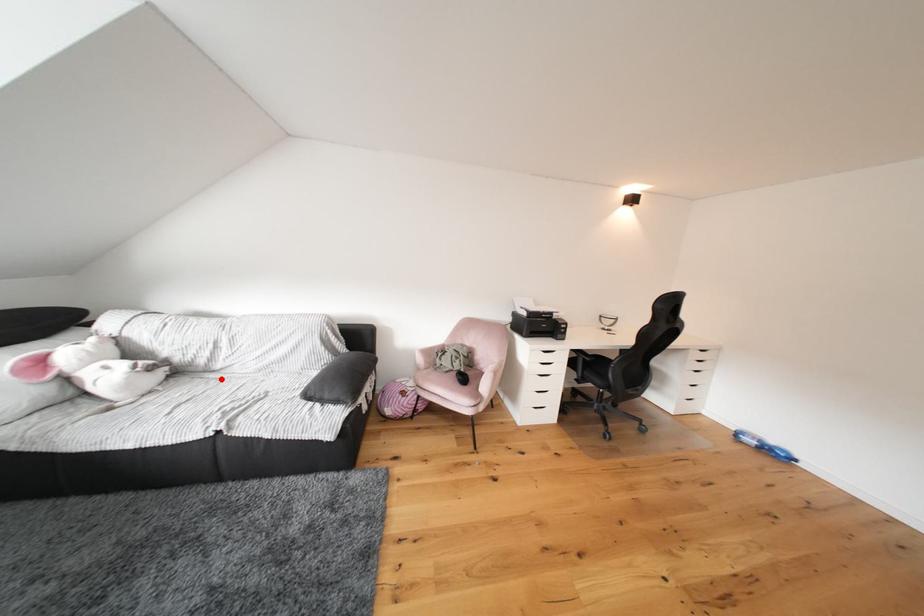
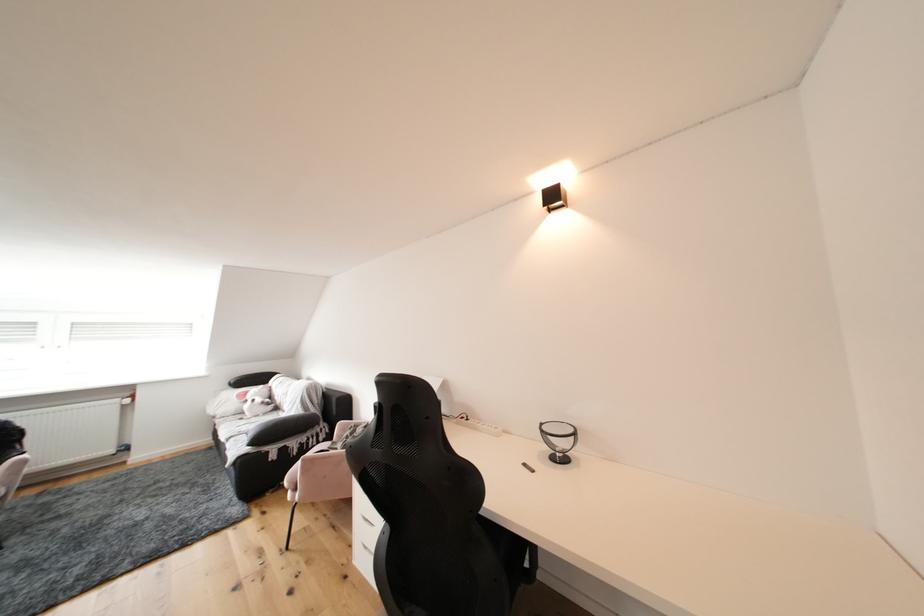
Question: I am providing you with two images of the same scene from different viewpoints. Image1 has a red point marked. In image2, the corresponding 3D location appears at what relative position? Reply with the corresponding letter.

Choices:
 (A) Closer
 (B) Farther

Answer: (B)